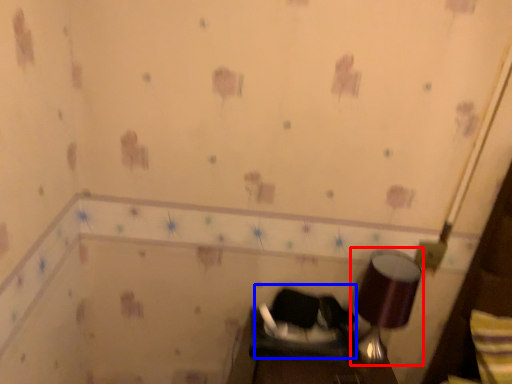
Question: Among these objects, which one is nearest to the camera, lamp (highlighted by a red box) or swivel chair (highlighted by a blue box)?

Choices:
 (A) lamp
 (B) swivel chair

Answer: (A)